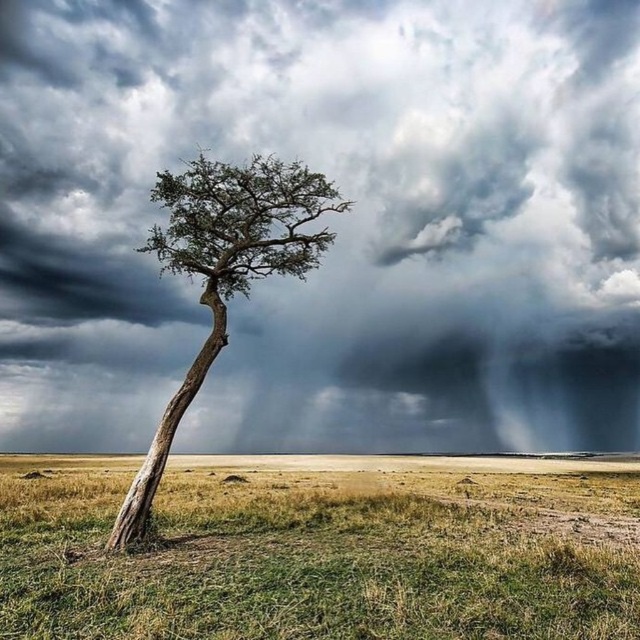
You are a hiker who just arrived at the center of the plain. You see the green grass at center and the green textured tree at center. How far apart are these two landmarks from each other?

The green grass at center and the green textured tree at center are 14.42 feet apart.

You are an observer looking at the landscape. Which object, the dark gray cloud at upper center or the green grass at center, is closer to you?

The dark gray cloud at upper center is closer to you because the green grass at center is behind it.

You are an artist planning to paint the scene. You want to ensure the dark gray cloud at upper center and the green textured tree at center are proportionally accurate. Which object should you make larger in your painting?

The dark gray cloud at upper center should be made larger than the green textured tree at center in the painting since it is described as larger in size.